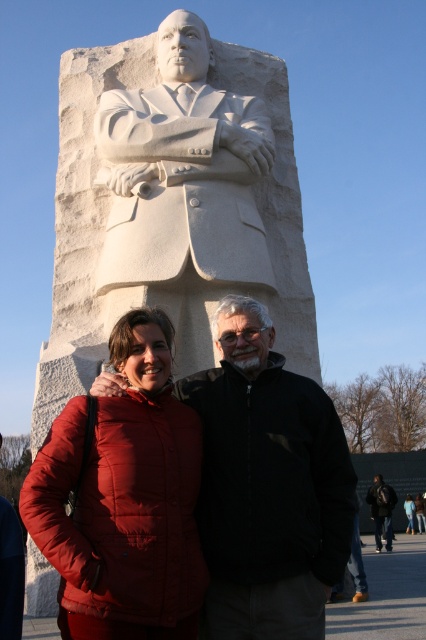
Question: Which is farther from the black matte jacket at center?

Choices:
 (A) matte red jacket at lower left
 (B) dark blue jeans at lower right
 (C) red puffer jacket at center
 (D) white marble statue at center

Answer: (C)

Question: Is dark blue jeans at lower right smaller than red puffer jacket at center?

Choices:
 (A) yes
 (B) no

Answer: (B)

Question: Does black matte jacket at center appear over matte red jacket at lower left?

Choices:
 (A) yes
 (B) no

Answer: (B)

Question: Which of the following is the closest to the observer?

Choices:
 (A) (420, 525)
 (B) (192, 605)
 (C) (305, 497)
 (D) (103, 154)

Answer: (B)

Question: Where is dark blue jeans at lower right located in relation to red puffer jacket at center in the image?

Choices:
 (A) left
 (B) right

Answer: (A)

Question: Which of the following is the farthest from the observer?

Choices:
 (A) (408, 524)
 (B) (45, 444)
 (C) (376, 509)

Answer: (A)